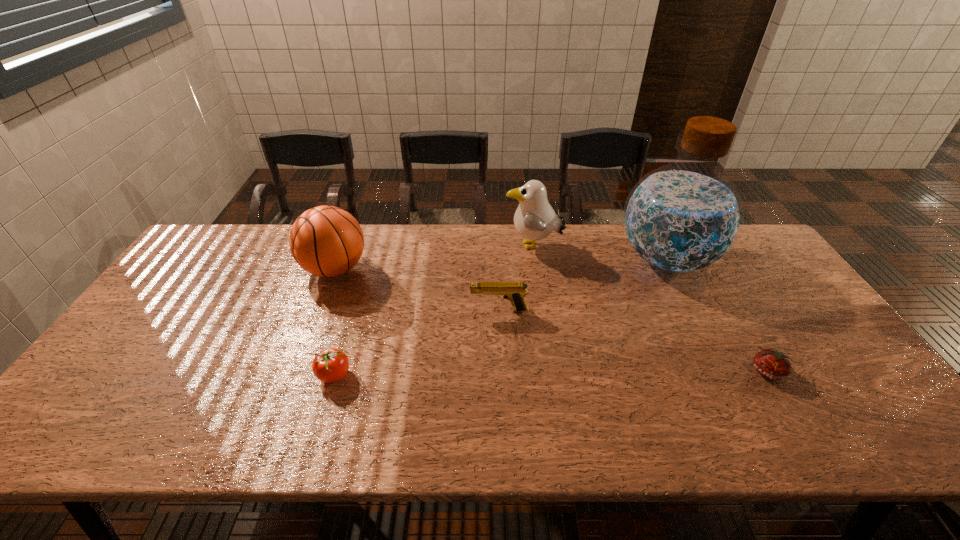
Locate an element on the screen. The width and height of the screenshot is (960, 540). water jug is located at coordinates (684, 217).

Locate an element on the screen. The height and width of the screenshot is (540, 960). gull is located at coordinates (534, 219).

The height and width of the screenshot is (540, 960). Identify the location of basketball. (326, 241).

Where is `the third nearest object`? This screenshot has height=540, width=960. the third nearest object is located at coordinates (513, 291).

Locate an element on the screen. This screenshot has height=540, width=960. the fourth tallest object is located at coordinates (513, 291).

Where is `the left tomato`? the left tomato is located at coordinates (330, 365).

At what (x,y) coordinates should I click in order to perform the action: click on the taller tomato. Please return your answer as a coordinate pair (x, y). The image size is (960, 540). Looking at the image, I should click on (330, 365).

At what (x,y) coordinates should I click in order to perform the action: click on the right tomato. Please return your answer as a coordinate pair (x, y). Looking at the image, I should click on (774, 365).

Where is `the shorter tomato`? The width and height of the screenshot is (960, 540). the shorter tomato is located at coordinates (774, 365).

The height and width of the screenshot is (540, 960). Identify the location of vacant region located on the front of the tallest object. (718, 362).